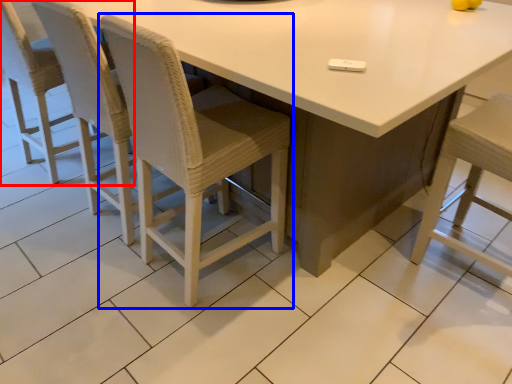
Question: Which of the following is the farthest to the observer, chair (highlighted by a red box) or chair (highlighted by a blue box)?

Choices:
 (A) chair
 (B) chair

Answer: (A)